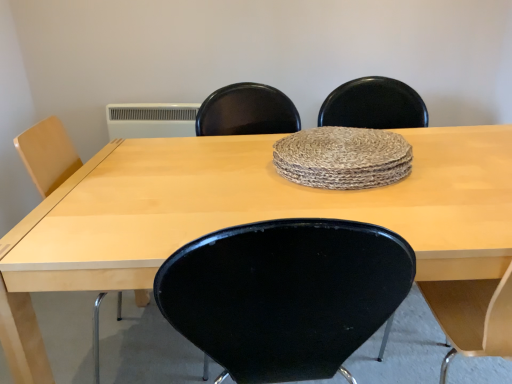
Image resolution: width=512 pixels, height=384 pixels. What do you see at coordinates (343, 158) in the screenshot? I see `natural fiber placemat at center` at bounding box center [343, 158].

This screenshot has width=512, height=384. In order to click on natural fiber placemat at center in this screenshot , I will do `click(343, 158)`.

The width and height of the screenshot is (512, 384). What do you see at coordinates (242, 216) in the screenshot?
I see `light wood table at center` at bounding box center [242, 216].

Find the location of `light wood table at center`. light wood table at center is located at coordinates (242, 216).

At what (x,y) coordinates should I click in order to perform the action: click on natural fiber placemat at center. Please return your answer as a coordinate pair (x, y). The width and height of the screenshot is (512, 384). Looking at the image, I should click on (343, 158).

Would you say natural fiber placemat at center is to the left or to the right of light wood table at center in the picture?

natural fiber placemat at center is to the right of light wood table at center.

Which object is more forward, natural fiber placemat at center or light wood table at center?

light wood table at center is more forward.

Does point (399, 155) appear closer or farther from the camera than point (32, 340)?

Clearly, point (399, 155) is more distant from the camera than point (32, 340).

From the image's perspective, which one is positioned higher, natural fiber placemat at center or light wood table at center?

natural fiber placemat at center is shown above in the image.

In the scene shown: From a real-world perspective, between natural fiber placemat at center and light wood table at center, who is vertically lower?

In real-world perspective, light wood table at center is lower.

Is natural fiber placemat at center wider or thinner than light wood table at center?

Clearly, natural fiber placemat at center has less width compared to light wood table at center.

Does natural fiber placemat at center have a lesser height compared to light wood table at center?

Yes.

Can you confirm if natural fiber placemat at center is smaller than light wood table at center?

Indeed, natural fiber placemat at center has a smaller size compared to light wood table at center.

Is natural fiber placemat at center outside of light wood table at center?

Yes, natural fiber placemat at center is not within light wood table at center.

Is natural fiber placemat at center directly adjacent to light wood table at center?

No, natural fiber placemat at center is not in contact with light wood table at center.

Is natural fiber placemat at center oriented towards light wood table at center?

No, natural fiber placemat at center does not turn towards light wood table at center.

How many degrees apart are the facing directions of natural fiber placemat at center and light wood table at center?

natural fiber placemat at center and light wood table at center are facing 1.28 degrees away from each other.

I want to click on mat lying behind the light wood table at center, so click(343, 158).

Is light wood table at center to the left or to the right of natural fiber placemat at center in the image?

light wood table at center is to the left of natural fiber placemat at center.

Which object is further away from the camera, light wood table at center or natural fiber placemat at center?

natural fiber placemat at center is more distant.

Does point (504, 158) lie in front of point (403, 137)?

Yes, it is.

From the image's perspective, which is above, light wood table at center or natural fiber placemat at center?

natural fiber placemat at center is shown above in the image.

From a real-world perspective, which object rests below the other?

light wood table at center, from a real-world perspective.

Is light wood table at center wider or thinner than natural fiber placemat at center?

In the image, light wood table at center appears to be wider than natural fiber placemat at center.

Considering the sizes of objects light wood table at center and natural fiber placemat at center in the image provided, who is shorter, light wood table at center or natural fiber placemat at center?

natural fiber placemat at center.

Is light wood table at center bigger or smaller than natural fiber placemat at center?

Considering their sizes, light wood table at center takes up more space than natural fiber placemat at center.

Is natural fiber placemat at center surrounded by light wood table at center?

No, natural fiber placemat at center is not surrounded by light wood table at center.

Are light wood table at center and natural fiber placemat at center far apart?

No, light wood table at center is not far away from natural fiber placemat at center.

Is light wood table at center turned away from natural fiber placemat at center?

That's not correct — light wood table at center is not looking away from natural fiber placemat at center.

At what (x,y) coordinates should I click in order to perform the action: click on mat lying on the right of light wood table at center. Please return your answer as a coordinate pair (x, y). This screenshot has width=512, height=384. Looking at the image, I should click on (343, 158).

Where is `mat behind the light wood table at center`? The image size is (512, 384). mat behind the light wood table at center is located at coordinates (343, 158).

Locate an element on the screen. The width and height of the screenshot is (512, 384). table on the left side of natural fiber placemat at center is located at coordinates pos(242,216).